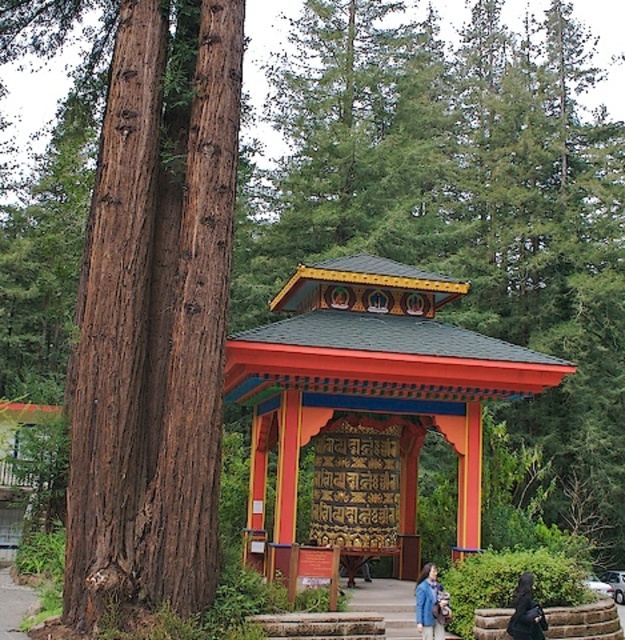
Who is taller, multicolored painted pavilion at center or black fabric coat at lower right?

multicolored painted pavilion at center is taller.

Can you confirm if multicolored painted pavilion at center is positioned below black fabric coat at lower right?

Actually, multicolored painted pavilion at center is above black fabric coat at lower right.

Is point (362, 298) less distant than point (532, 609)?

No.

Image resolution: width=625 pixels, height=640 pixels. What are the coordinates of `multicolored painted pavilion at center` in the screenshot? It's located at (371, 390).

Who is more forward, (448, 602) or (512, 612)?

Point (448, 602) is more forward.

Is blue denim jacket at lower right below black fabric coat at lower right?

Correct, blue denim jacket at lower right is located below black fabric coat at lower right.

The height and width of the screenshot is (640, 625). Find the location of `blue denim jacket at lower right`. blue denim jacket at lower right is located at coordinates (431, 604).

Identify the location of blue denim jacket at lower right. (431, 604).

Can you confirm if multicolored painted pavilion at center is taller than blue denim jacket at lower right?

Correct, multicolored painted pavilion at center is much taller as blue denim jacket at lower right.

Is multicolored painted pavilion at center smaller than blue denim jacket at lower right?

No.

Between point (328, 513) and point (442, 600), which one is positioned behind?

Point (328, 513)

Where is `multicolored painted pavilion at center`? Image resolution: width=625 pixels, height=640 pixels. multicolored painted pavilion at center is located at coordinates (371, 390).